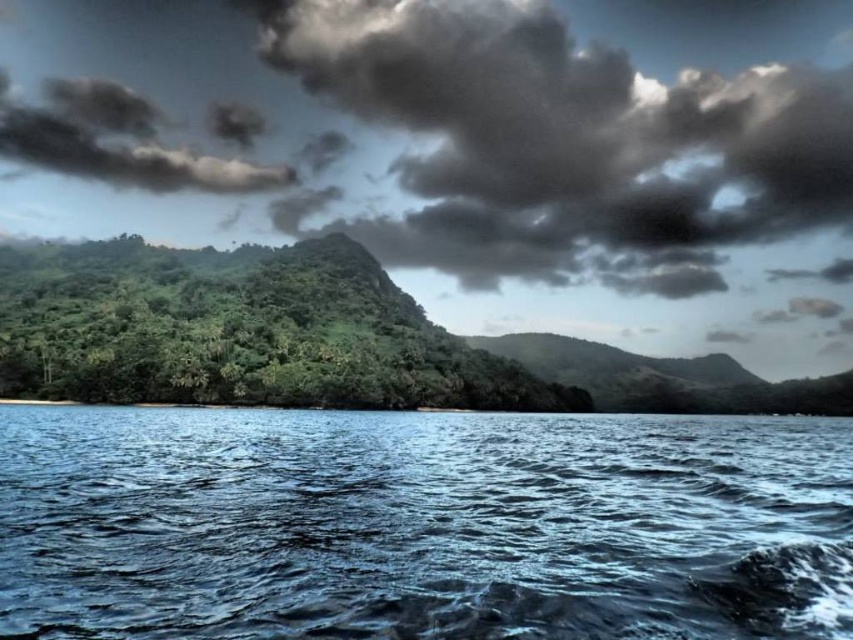
From the picture: Does dark gray fluffy cloud at upper center appear under dark gray fluffy cloud at upper left?

No.

Is the position of dark gray fluffy cloud at upper center less distant than that of dark gray fluffy cloud at upper left?

Yes.

The width and height of the screenshot is (853, 640). Find the location of `dark gray fluffy cloud at upper center`. dark gray fluffy cloud at upper center is located at coordinates (567, 141).

You are a GUI agent. You are given a task and a screenshot of the screen. Output one action in this format:
    pyautogui.click(x=<x>, y=<y>)
    Task: Click on the dark gray fluffy cloud at upper center
    
    Given the screenshot: What is the action you would take?
    pyautogui.click(x=567, y=141)

Is green leafy forest at center in front of dark gray fluffy cloud at upper left?

Yes, green leafy forest at center is in front of dark gray fluffy cloud at upper left.

What do you see at coordinates (239, 330) in the screenshot? I see `green leafy forest at center` at bounding box center [239, 330].

Where is `green leafy forest at center`? green leafy forest at center is located at coordinates (239, 330).

Is dark gray fluffy cloud at upper center closer to the viewer compared to green leafy forest at center?

No.

In the scene shown: Between dark gray fluffy cloud at upper center and green leafy forest at center, which one appears on the left side from the viewer's perspective?

From the viewer's perspective, green leafy forest at center appears more on the left side.

Which is behind, point (657, 180) or point (387, 339)?

The point (657, 180) is more distant.

Locate an element on the screen. The width and height of the screenshot is (853, 640). dark gray fluffy cloud at upper center is located at coordinates (567, 141).